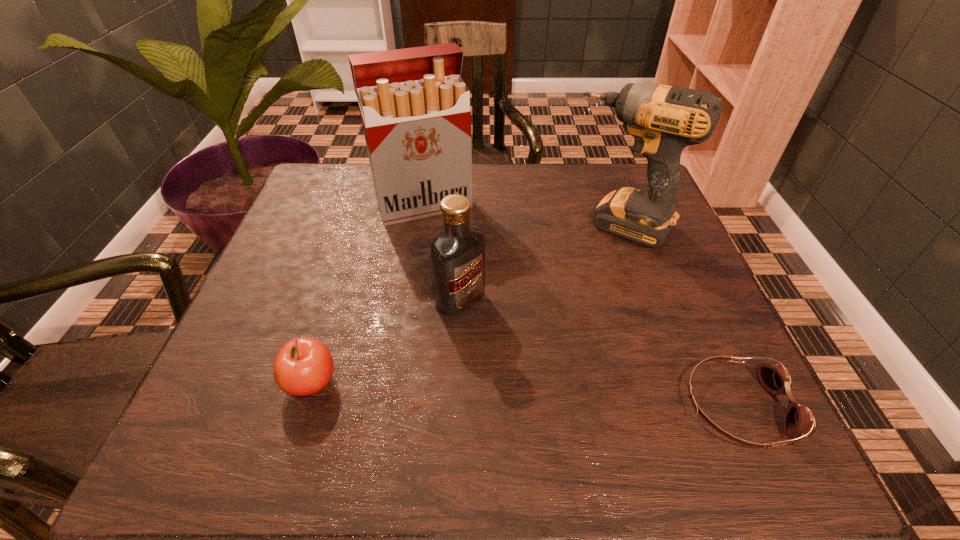
In the image, there is a desktop. What are the coordinates of `vacant space at the far left corner` in the screenshot? It's located at (356, 167).

The height and width of the screenshot is (540, 960). Find the location of `empty space that is in between the second shortest object and the cigarette case`. empty space that is in between the second shortest object and the cigarette case is located at coordinates (368, 294).

In order to click on unoccupied position between the second shortest object and the shortest object in this screenshot , I will do `click(523, 395)`.

I want to click on vacant space that is in between the drill and the vodka, so click(x=540, y=262).

Locate an element on the screen. This screenshot has height=540, width=960. empty space between the drill and the goggles is located at coordinates (679, 316).

Where is `empty space that is in between the shortest object and the drill`? empty space that is in between the shortest object and the drill is located at coordinates (679, 316).

Image resolution: width=960 pixels, height=540 pixels. I want to click on free space between the goggles and the third farthest object, so click(x=598, y=353).

Image resolution: width=960 pixels, height=540 pixels. What are the coordinates of `free point between the drill and the shortest object` in the screenshot? It's located at pos(679,316).

At what (x,y) coordinates should I click in order to perform the action: click on blank region between the drill and the goggles. Please return your answer as a coordinate pair (x, y). The width and height of the screenshot is (960, 540). Looking at the image, I should click on (679, 316).

In order to click on unoccupied area between the apple and the cigarette case in this screenshot , I will do `click(368, 294)`.